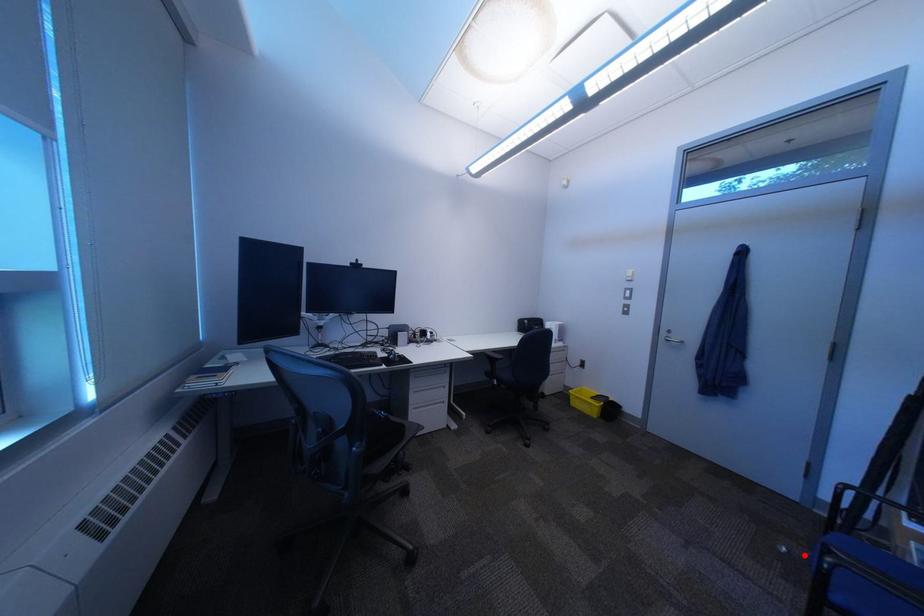
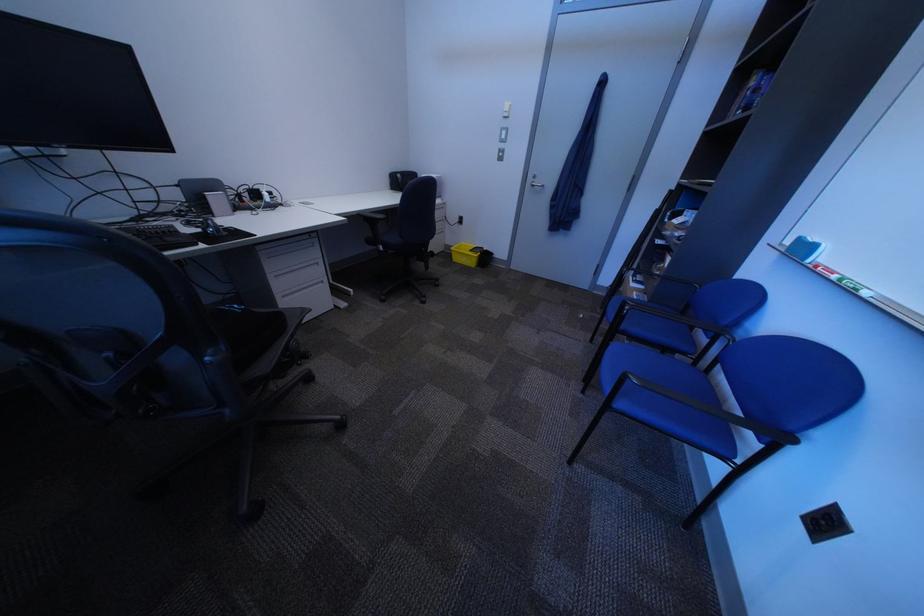
The point at the highlighted location is marked in the first image. Where is the corresponding point in the second image?

(599, 318)